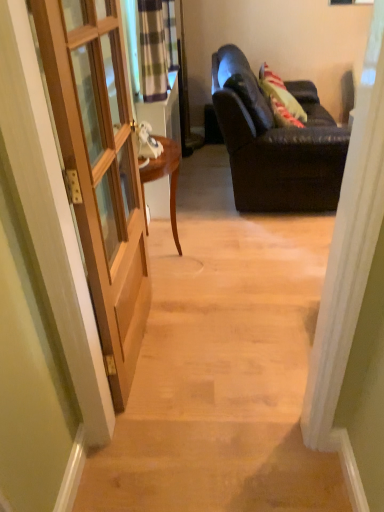
Question: From the image's perspective, is wooden door at left beneath dark brown leather couch at right?

Choices:
 (A) no
 (B) yes

Answer: (B)

Question: Is wooden door at left to the left of dark brown leather couch at right from the viewer's perspective?

Choices:
 (A) no
 (B) yes

Answer: (B)

Question: Is wooden door at left shorter than dark brown leather couch at right?

Choices:
 (A) yes
 (B) no

Answer: (B)

Question: Considering the relative sizes of wooden door at left and dark brown leather couch at right in the image provided, is wooden door at left taller than dark brown leather couch at right?

Choices:
 (A) no
 (B) yes

Answer: (B)

Question: From a real-world perspective, is wooden door at left located higher than dark brown leather couch at right?

Choices:
 (A) yes
 (B) no

Answer: (A)

Question: Considering the positions of dark brown leather couch at right and wooden door at left in the image, is dark brown leather couch at right taller or shorter than wooden door at left?

Choices:
 (A) tall
 (B) short

Answer: (B)

Question: Choose the correct answer: Is dark brown leather couch at right inside wooden door at left or outside it?

Choices:
 (A) outside
 (B) inside

Answer: (A)

Question: Looking at the image, does dark brown leather couch at right seem bigger or smaller compared to wooden door at left?

Choices:
 (A) big
 (B) small

Answer: (A)

Question: Considering the positions of point (233, 105) and point (64, 143), is point (233, 105) closer or farther from the camera than point (64, 143)?

Choices:
 (A) farther
 (B) closer

Answer: (A)

Question: Is wooden door at left situated inside plaid fabric curtain at upper left or outside?

Choices:
 (A) inside
 (B) outside

Answer: (B)

Question: From the image's perspective, is wooden door at left above or below plaid fabric curtain at upper left?

Choices:
 (A) above
 (B) below

Answer: (B)

Question: Relative to plaid fabric curtain at upper left, is wooden door at left in front or behind?

Choices:
 (A) front
 (B) behind

Answer: (A)

Question: In terms of width, does wooden door at left look wider or thinner when compared to plaid fabric curtain at upper left?

Choices:
 (A) wide
 (B) thin

Answer: (B)

Question: From the image's perspective, is dark brown leather couch at right positioned above or below wooden door at left?

Choices:
 (A) above
 (B) below

Answer: (A)

Question: Looking at their shapes, would you say dark brown leather couch at right is wider or thinner than wooden door at left?

Choices:
 (A) wide
 (B) thin

Answer: (B)